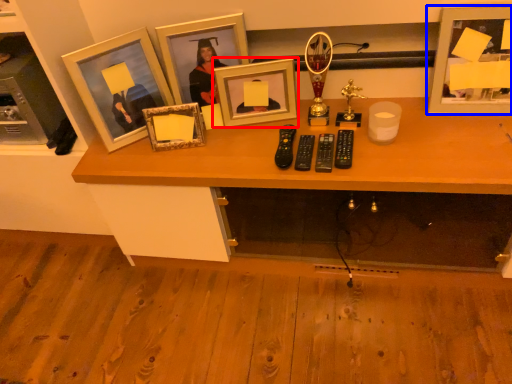
Question: Which point is further to the camera, picture frame (highlighted by a red box) or picture frame (highlighted by a blue box)?

Choices:
 (A) picture frame
 (B) picture frame

Answer: (A)